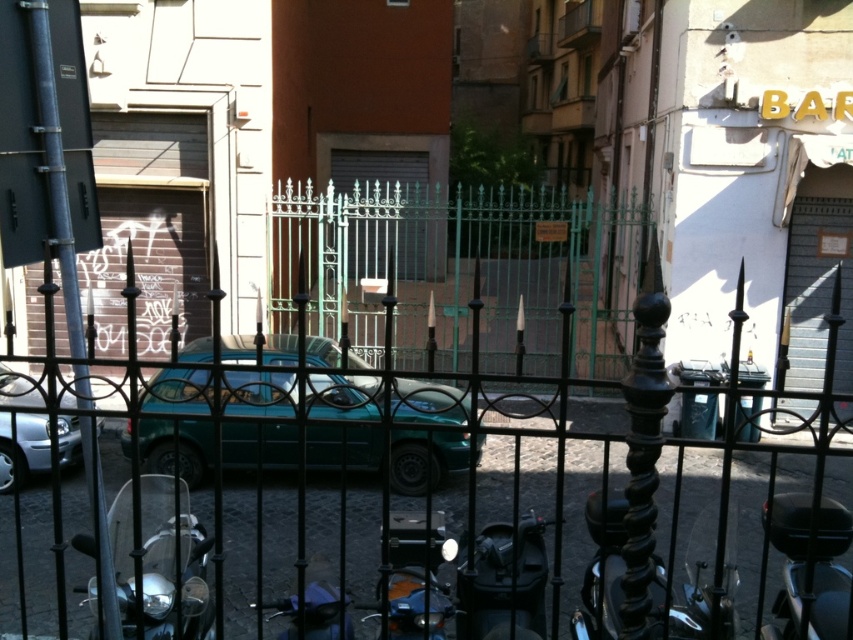
Which is more to the left, green wrought iron gate at center or shiny silver motorcycle at lower left?

shiny silver motorcycle at lower left is more to the left.

Does point (508, 292) lie behind point (186, 620)?

Yes, it is behind point (186, 620).

Locate an element on the screen. green wrought iron gate at center is located at coordinates (460, 269).

Which is in front, point (436, 410) or point (361, 256)?

Point (436, 410) is in front.

Which of these two, black wrought iron fence at center or green wrought iron gate at center, stands taller?

Standing taller between the two is green wrought iron gate at center.

Does point (379, 276) come farther from viewer compared to point (306, 202)?

Yes, it is.

The image size is (853, 640). In order to click on black wrought iron fence at center in this screenshot , I will do `click(451, 428)`.

Who is positioned more to the left, green wrought iron gate at center or teal matte car at center?

teal matte car at center

How far apart are green wrought iron gate at center and teal matte car at center?

green wrought iron gate at center and teal matte car at center are 17.55 feet apart from each other.

Which is in front, point (601, 316) or point (352, 413)?

Point (352, 413) is more forward.

This screenshot has width=853, height=640. I want to click on green wrought iron gate at center, so click(x=460, y=269).